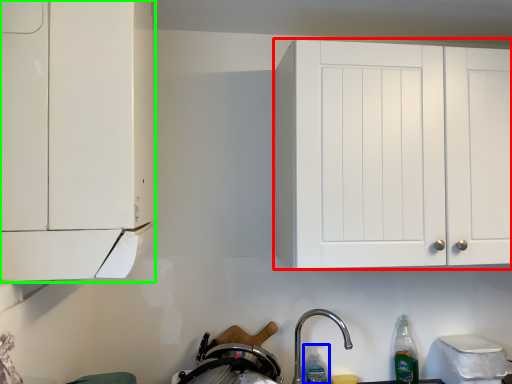
Question: Estimate the real-world distances between objects in this image. Which object is farther from cabinetry (highlighted by a red box), bottle (highlighted by a blue box) or cabinetry (highlighted by a green box)?

Choices:
 (A) bottle
 (B) cabinetry

Answer: (A)